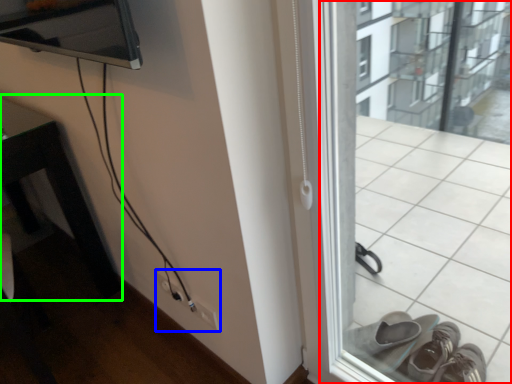
Question: Estimate the real-world distances between objects in this image. Which object is farther from window frame (highlighted by a red box), electric outlet (highlighted by a blue box) or table (highlighted by a green box)?

Choices:
 (A) electric outlet
 (B) table

Answer: (B)